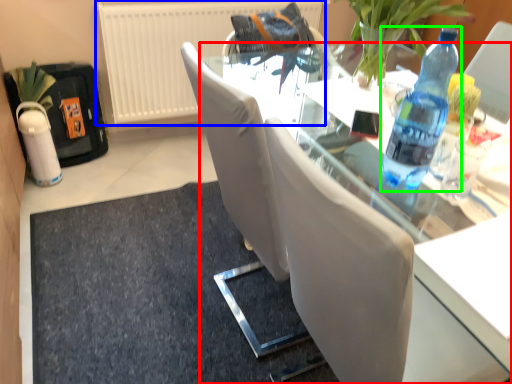
Question: Which object is positioned closest to table (highlighted by a red box)? Select from radiator (highlighted by a blue box) and bottle (highlighted by a green box).

Choices:
 (A) radiator
 (B) bottle

Answer: (B)